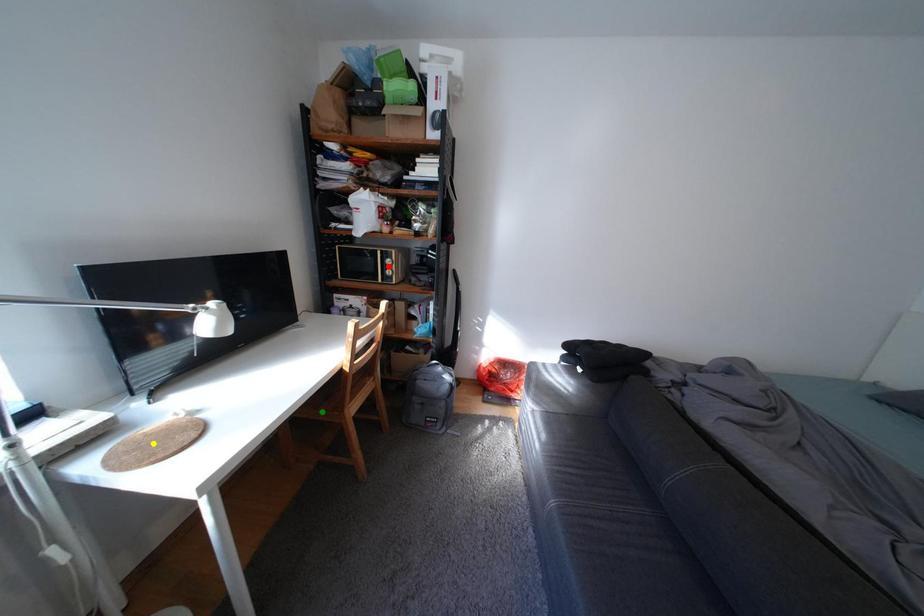
Order these from nearest to farthest:
yellow point | green point | red point

red point < green point < yellow point